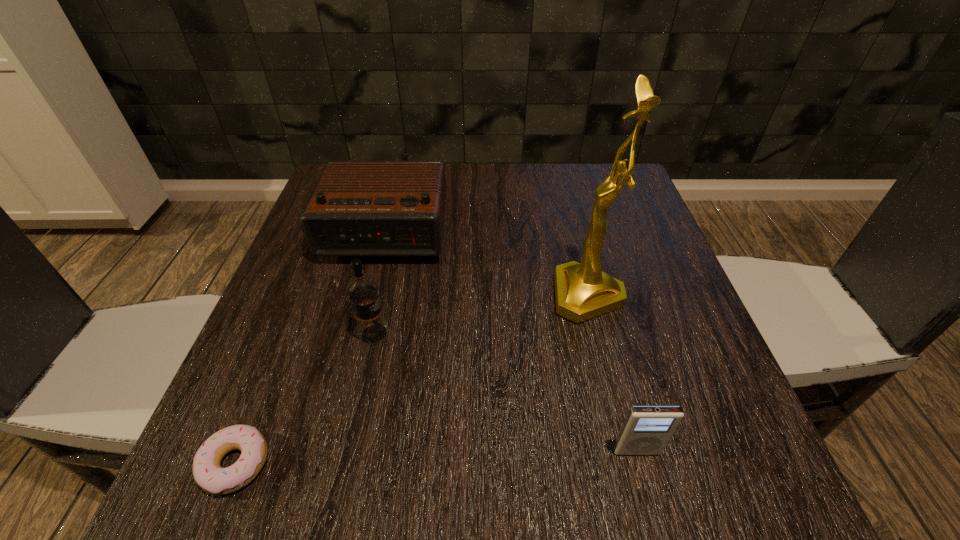
The width and height of the screenshot is (960, 540). Find the location of `the tallest object`. the tallest object is located at coordinates (583, 291).

I want to click on the fourth shortest object, so click(363, 293).

You are a GUI agent. You are given a task and a screenshot of the screen. Output one action in this format:
    pyautogui.click(x=<x>, y=<y>)
    Task: Click on the farthest object
    The height and width of the screenshot is (540, 960).
    Given the screenshot: What is the action you would take?
    pyautogui.click(x=359, y=208)

You are a GUI agent. You are given a task and a screenshot of the screen. Output one action in this format:
    pyautogui.click(x=<x>, y=<y>)
    Task: Click on the radio receiver
    This screenshot has height=540, width=960.
    Given the screenshot: What is the action you would take?
    pyautogui.click(x=359, y=208)

This screenshot has height=540, width=960. What are the coordinates of `iPod` in the screenshot? It's located at (646, 430).

At what (x,y) coordinates should I click in order to perform the action: click on doughnut. Please return your answer as a coordinate pair (x, y). This screenshot has width=960, height=540. Looking at the image, I should click on (209, 475).

Image resolution: width=960 pixels, height=540 pixels. What are the coordinates of `free space located 0.140m on the front-facing side of the award` in the screenshot? It's located at (481, 295).

The image size is (960, 540). I want to click on free region located on the front-facing side of the award, so click(x=481, y=295).

Locate an element on the screen. vacant area situated 0.100m on the front-facing side of the award is located at coordinates (501, 295).

Locate an element on the screen. The width and height of the screenshot is (960, 540). vacant space located on the label of the second tallest object is located at coordinates (485, 334).